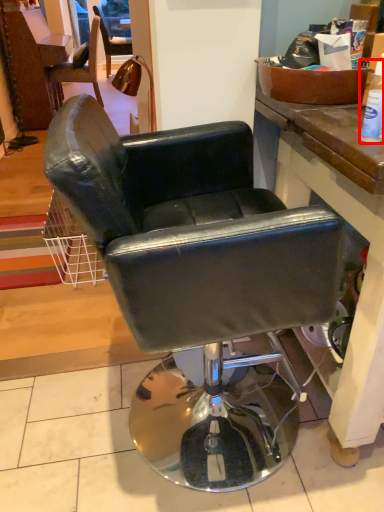
Question: From the image, what is the correct spatial relationship of bottle (annotated by the red box) in relation to chair?

Choices:
 (A) left
 (B) right

Answer: (B)